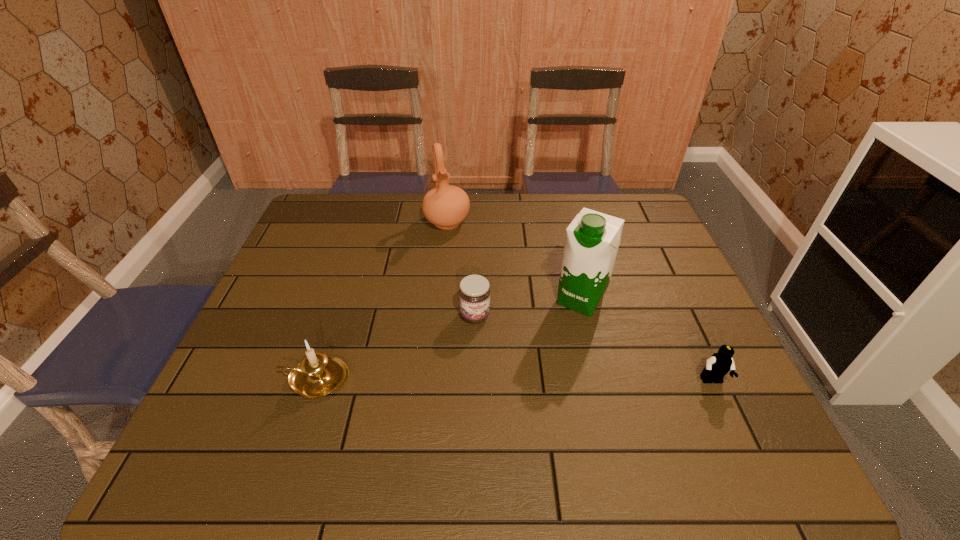
The height and width of the screenshot is (540, 960). I want to click on free space on the desktop that is between the candle holder and the Lego and is positioned on the front-facing side of the second object from right to left, so click(x=530, y=380).

The image size is (960, 540). Identify the location of vacant space on the desktop that is between the candle holder and the Lego and is positioned on the front label of the jam. (501, 380).

This screenshot has width=960, height=540. Find the location of `vacant space on the desktop that is between the leftmost object and the rightmost object and is positioned on the spout of the pottery`. vacant space on the desktop that is between the leftmost object and the rightmost object and is positioned on the spout of the pottery is located at coordinates (494, 380).